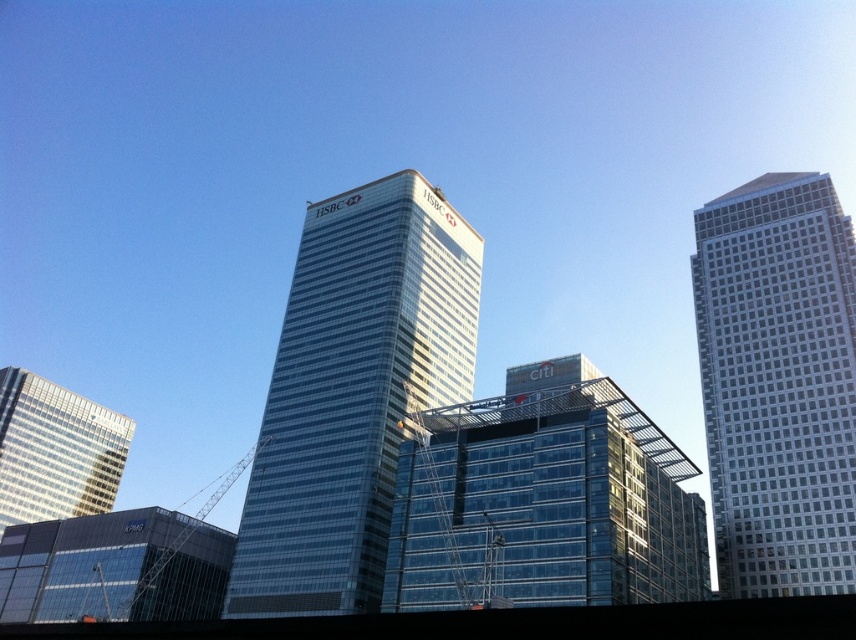
Which of these two, glassy skyscraper at center or transparent glass building at lower left, stands taller?

With more height is glassy skyscraper at center.

Is glassy skyscraper at center thinner than transparent glass building at lower left?

Indeed, glassy skyscraper at center has a lesser width compared to transparent glass building at lower left.

The image size is (856, 640). What do you see at coordinates (354, 392) in the screenshot?
I see `glassy skyscraper at center` at bounding box center [354, 392].

Where is `glassy skyscraper at center`? The width and height of the screenshot is (856, 640). glassy skyscraper at center is located at coordinates (354, 392).

Which is more to the right, transparent glass building at center or white glass skyscraper at right?

Positioned to the right is white glass skyscraper at right.

What do you see at coordinates (544, 500) in the screenshot? I see `transparent glass building at center` at bounding box center [544, 500].

What do you see at coordinates (544, 500) in the screenshot? I see `transparent glass building at center` at bounding box center [544, 500].

Where is `transparent glass building at center`? Image resolution: width=856 pixels, height=640 pixels. transparent glass building at center is located at coordinates (544, 500).

From the picture: Is glassy skyscraper at center further to camera compared to glassy reflective skyscraper at lower left?

No.

At what (x,y) coordinates should I click in order to perform the action: click on glassy skyscraper at center. Please return your answer as a coordinate pair (x, y). Looking at the image, I should click on (354, 392).

Locate an element on the screen. glassy skyscraper at center is located at coordinates (354, 392).